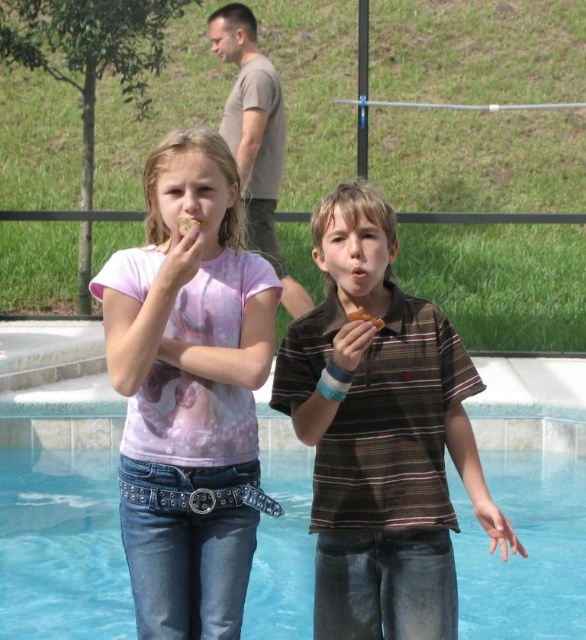
You are a photographer trying to capture the scene of the two children by the pool. You want to ensure the brown striped shirt at center and the transparent glass water at lower center are both visible in the shot. Based on their positions, which object should appear higher in the photo?

The brown striped shirt at center is located above transparent glass water at lower center, so it should appear higher in the photo.

You are a photographer trying to capture a candid shot of the two children eating. You notice the brown striped shirt at center and the transparent glass water at lower center in your frame. Which object should you adjust your focus to avoid blurring the children?

You should focus on the brown striped shirt at center because it is positioned on the right side of transparent glass water at lower center, meaning it is closer to the children and adjusting focus on it will ensure the children remain sharp.